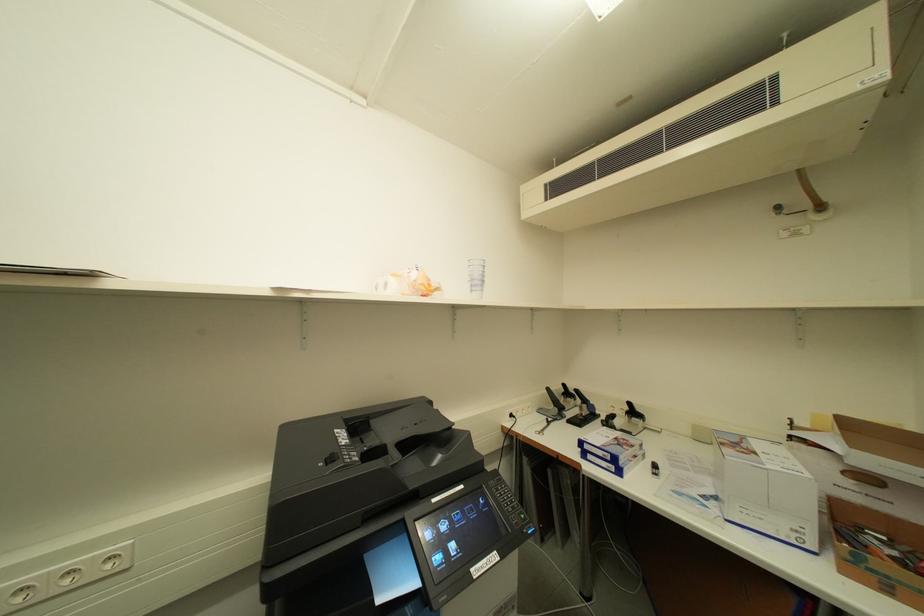
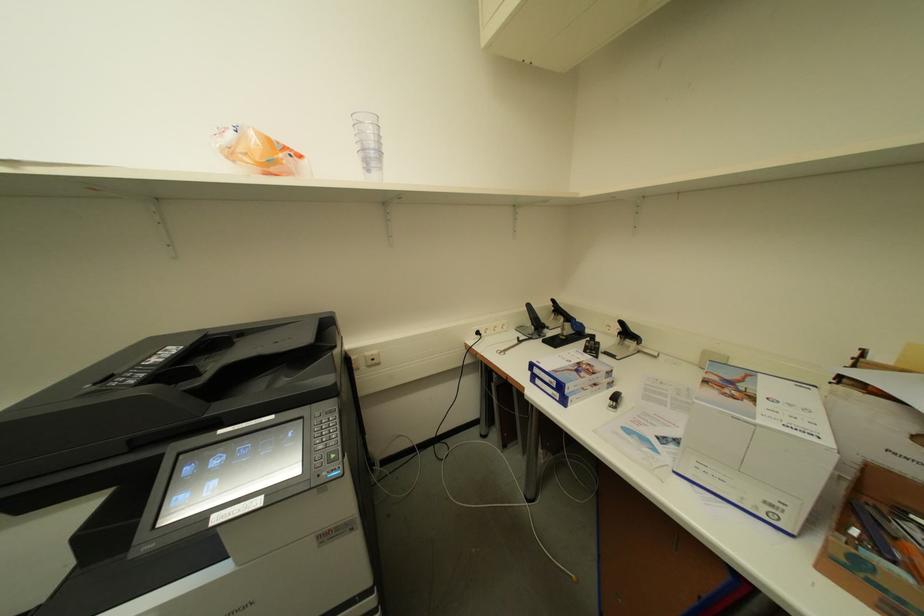
Which direction would the cameraman need to move to produce the second image?

The cameraman moved toward right, forward.